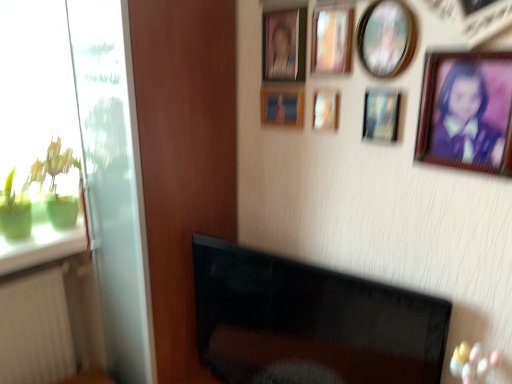
Question: From the image's perspective, is wooden picture frame at upper center, marked as the 3th picture frame in a left-to-right arrangement, above or below transparent glass door at left?

Choices:
 (A) above
 (B) below

Answer: (A)

Question: Is wooden picture frame at upper center, the 5th picture frame in the right-to-left sequence, bigger or smaller than transparent glass door at left?

Choices:
 (A) small
 (B) big

Answer: (A)

Question: Based on their relative distances, which object is farther from the wooden picture frame at upper center, marked as the 5th picture frame in a left-to-right arrangement?

Choices:
 (A) green glass at left
 (B) white plastic radiator at lower left
 (C) transparent glass door at left
 (D) wooden picture frame at upper center, which is counted as the second picture frame, starting from the right
 (E) wooden picture frame at upper center, marked as the 3th picture frame in a left-to-right arrangement

Answer: (B)

Question: Which of these objects is positioned farthest from the white plastic radiator at lower left?

Choices:
 (A) wooden picture frame at upper center, marked as the 5th picture frame in a left-to-right arrangement
 (B) green glass at left
 (C) wooden picture frame at upper center, which ranks as the sixth picture frame in left-to-right order
 (D) transparent glass door at left
 (E) wooden picture frame at upper center, which is counted as the 4th picture frame, starting from the left

Answer: (A)